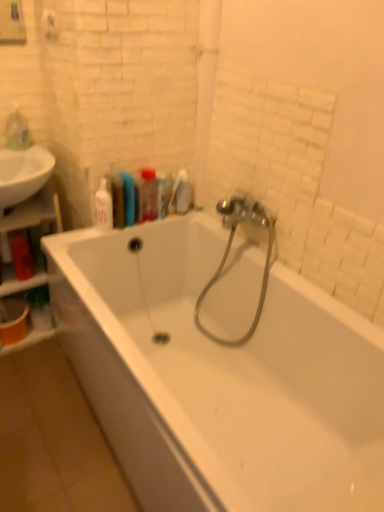
Question: Is white glossy soap dispenser at upper left, the 2th toiletry from the left, smaller than translucent plastic bottle at upper center, marked as the third toiletry in a left-to-right arrangement?

Choices:
 (A) no
 (B) yes

Answer: (A)

Question: Is white glossy soap dispenser at upper left, the 2th toiletry from the left, to the right of translucent plastic bottle at upper center, marked as the third toiletry in a left-to-right arrangement, from the viewer's perspective?

Choices:
 (A) yes
 (B) no

Answer: (B)

Question: Does white glossy soap dispenser at upper left, the 2th toiletry from the left, turn towards translucent plastic bottle at upper center, marked as the 2th toiletry in a right-to-left arrangement?

Choices:
 (A) yes
 (B) no

Answer: (B)

Question: Is white glossy soap dispenser at upper left, which is the 3th toiletry from right to left, oriented away from translucent plastic bottle at upper center, marked as the 2th toiletry in a right-to-left arrangement?

Choices:
 (A) no
 (B) yes

Answer: (A)

Question: Is translucent plastic bottle at upper center, marked as the third toiletry in a left-to-right arrangement, a part of white glossy soap dispenser at upper left, which is the 3th toiletry from right to left?

Choices:
 (A) no
 (B) yes

Answer: (A)

Question: From a real-world perspective, is wooden shelf at left physically located above or below translucent plastic toothbrush at upper center, placed as the first toiletry when sorted from right to left?

Choices:
 (A) below
 (B) above

Answer: (A)

Question: Does point tap(16, 209) appear closer or farther from the camera than point tap(162, 182)?

Choices:
 (A) farther
 (B) closer

Answer: (A)

Question: Looking at their shapes, would you say wooden shelf at left is wider or thinner than translucent plastic toothbrush at upper center, which is the 4th toiletry from left to right?

Choices:
 (A) thin
 (B) wide

Answer: (B)

Question: From the image's perspective, relative to translucent plastic toothbrush at upper center, placed as the first toiletry when sorted from right to left, is wooden shelf at left above or below?

Choices:
 (A) above
 (B) below

Answer: (B)

Question: Is translucent plastic toothbrush at upper center, which is the 4th toiletry from left to right, inside or outside of white glossy sink at left?

Choices:
 (A) inside
 (B) outside

Answer: (B)

Question: Is point (158, 194) positioned closer to the camera than point (21, 168)?

Choices:
 (A) farther
 (B) closer

Answer: (A)

Question: Would you say translucent plastic toothbrush at upper center, which is the 4th toiletry from left to right, is to the left or to the right of white glossy sink at left in the picture?

Choices:
 (A) right
 (B) left

Answer: (A)

Question: Looking at their shapes, would you say translucent plastic toothbrush at upper center, placed as the first toiletry when sorted from right to left, is wider or thinner than white glossy sink at left?

Choices:
 (A) wide
 (B) thin

Answer: (B)

Question: Is white matte towel bar at upper left wider or thinner than wooden shelf at left?

Choices:
 (A) wide
 (B) thin

Answer: (B)

Question: From the image's perspective, relative to wooden shelf at left, is white matte towel bar at upper left above or below?

Choices:
 (A) above
 (B) below

Answer: (A)